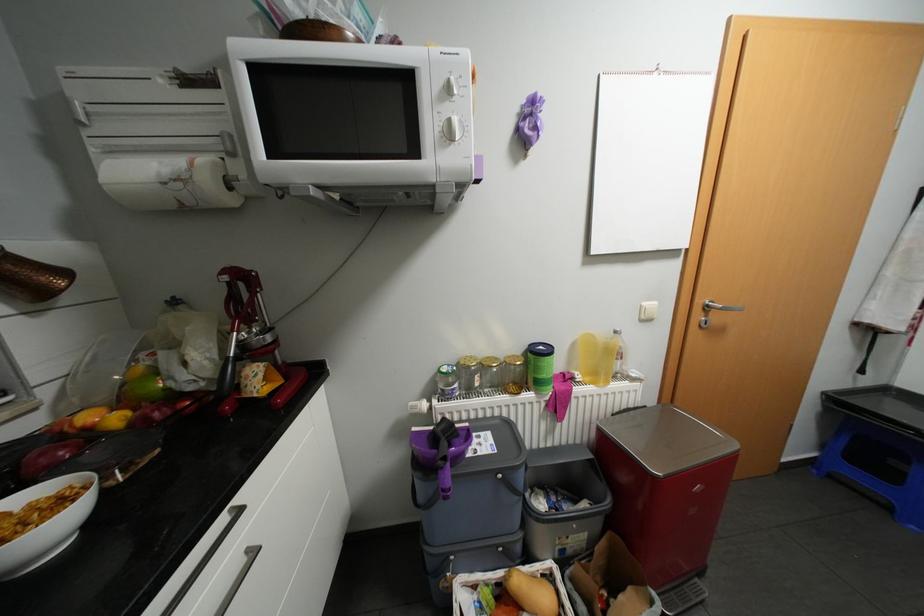
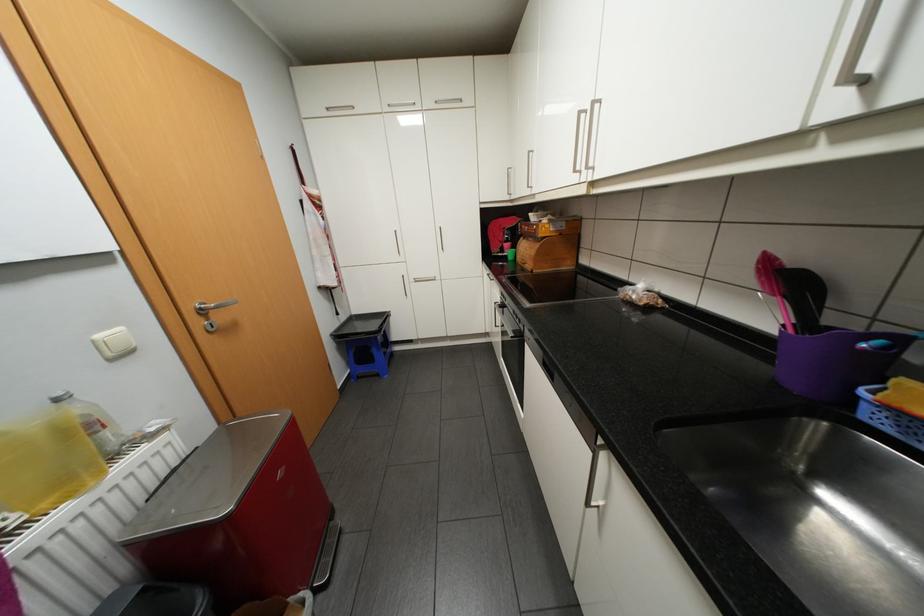
The first image is from the beginning of the video and the second image is from the end. How did the camera likely rotate when shooting the video?

The rotation direction of the camera is right-down.